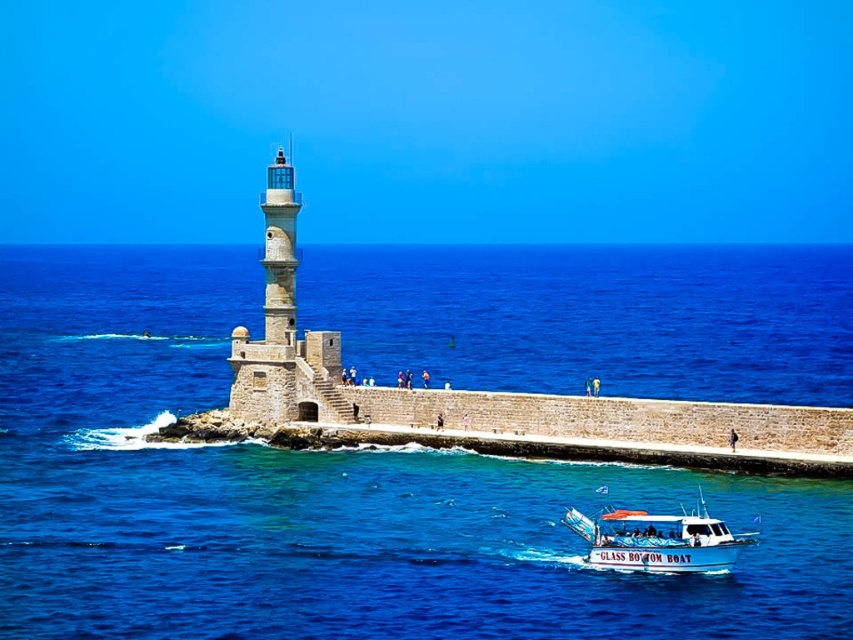
Question: Does stone lighthouse at center have a lesser width compared to white glossy glass-bottom boat at lower center?

Choices:
 (A) no
 (B) yes

Answer: (B)

Question: Observing the image, what is the correct spatial positioning of blue stone water at center in reference to white glossy glass-bottom boat at lower center?

Choices:
 (A) left
 (B) right

Answer: (A)

Question: Considering the real-world distances, which object is farthest from the blue stone water at center?

Choices:
 (A) smooth stone lighthouse at center
 (B) stone lighthouse at center

Answer: (A)

Question: Which point is farther to the camera?

Choices:
 (A) white glossy glass-bottom boat at lower center
 (B) blue stone water at center
 (C) smooth stone lighthouse at center

Answer: (C)

Question: Which of the following is the farthest from the observer?

Choices:
 (A) smooth stone lighthouse at center
 (B) stone lighthouse at center

Answer: (A)

Question: Does blue stone water at center have a greater width compared to white glossy glass-bottom boat at lower center?

Choices:
 (A) yes
 (B) no

Answer: (A)